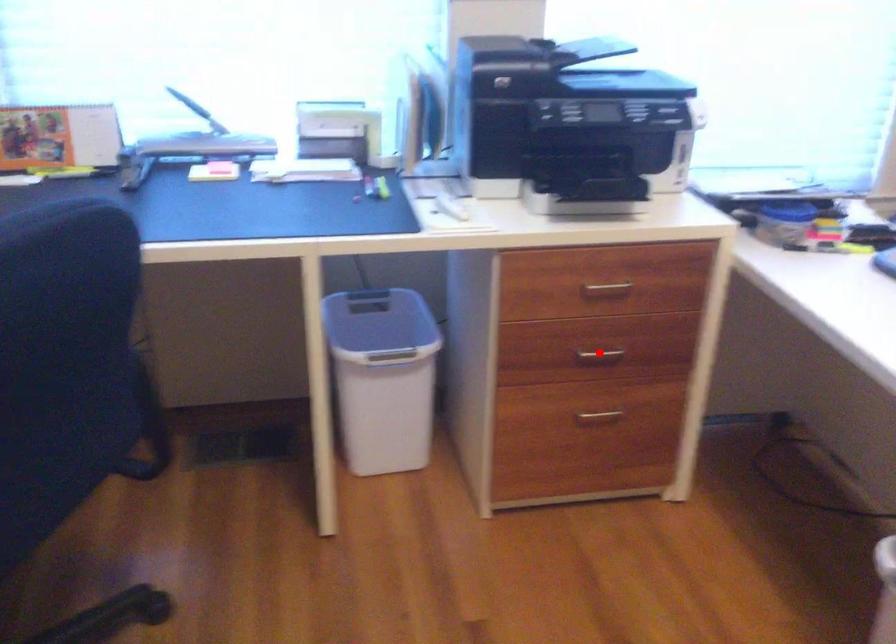
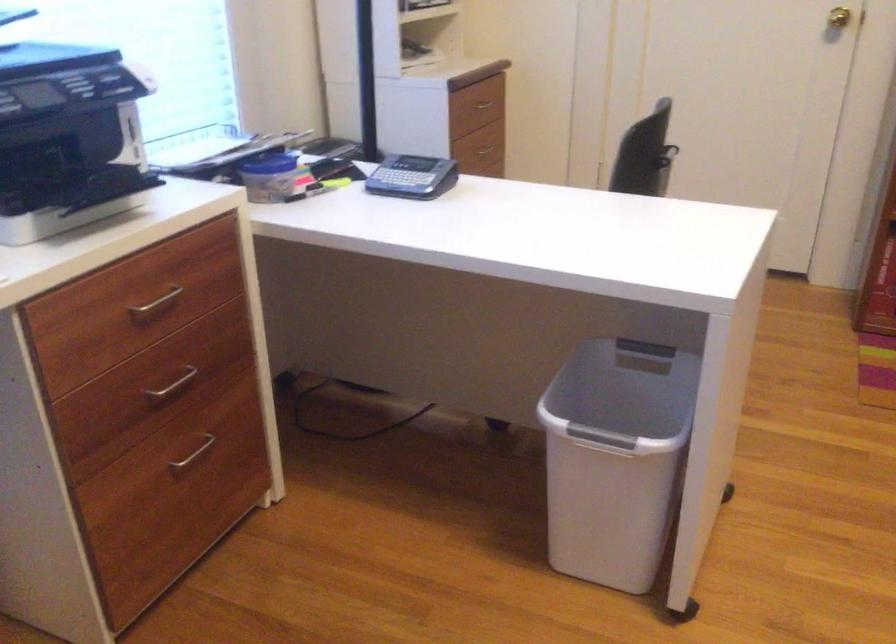
In the second image, find the point that corresponds to the highlighted location in the first image.

(173, 384)